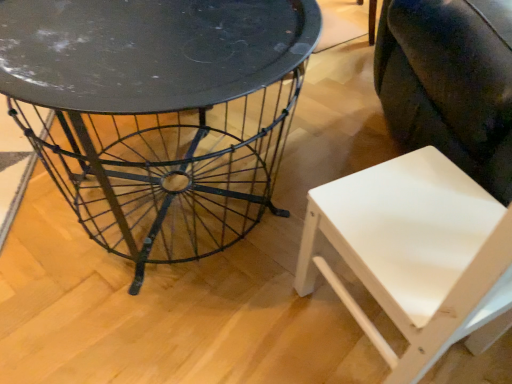
Question: Is point (387, 360) closer or farther from the camera than point (471, 124)?

Choices:
 (A) closer
 (B) farther

Answer: (B)

Question: Considering the relative positions of white matte chair at lower right and white matte swivel chair at lower right in the image provided, is white matte chair at lower right to the left or to the right of white matte swivel chair at lower right?

Choices:
 (A) left
 (B) right

Answer: (A)

Question: Which object is positioned farthest from the white matte chair at lower right?

Choices:
 (A) metallic wire table at center
 (B) white matte swivel chair at lower right

Answer: (A)

Question: Which of these objects is positioned farthest from the white matte chair at lower right?

Choices:
 (A) metallic wire table at center
 (B) white matte swivel chair at lower right

Answer: (A)